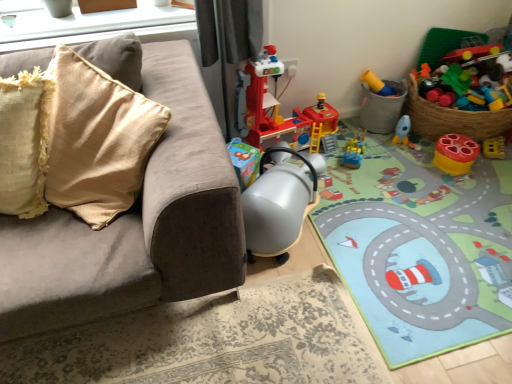
Find the location of a particular element. Image resolution: width=512 pixels, height=384 pixels. unoccupied space behind translucent plastic train at center, positioned as the second toy in left-to-right order is located at coordinates (362, 131).